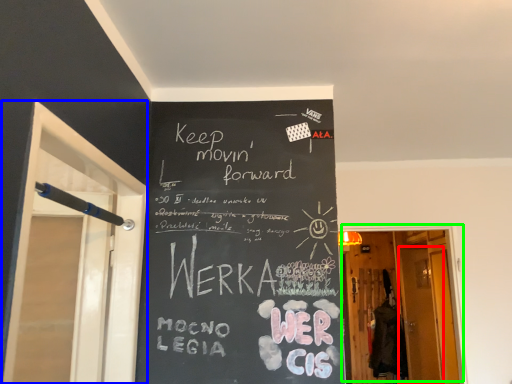
Question: Which object is positioned closest to screen door (highlighted by a red box)? Select from screen door (highlighted by a blue box) and door (highlighted by a green box).

Choices:
 (A) screen door
 (B) door

Answer: (B)